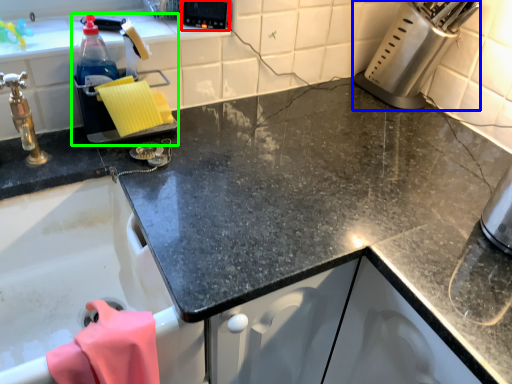
Question: Which object is positioned closest to appliance (highlighted by a red box)? Select from appliance (highlighted by a blue box) and appliance (highlighted by a green box).

Choices:
 (A) appliance
 (B) appliance

Answer: (B)